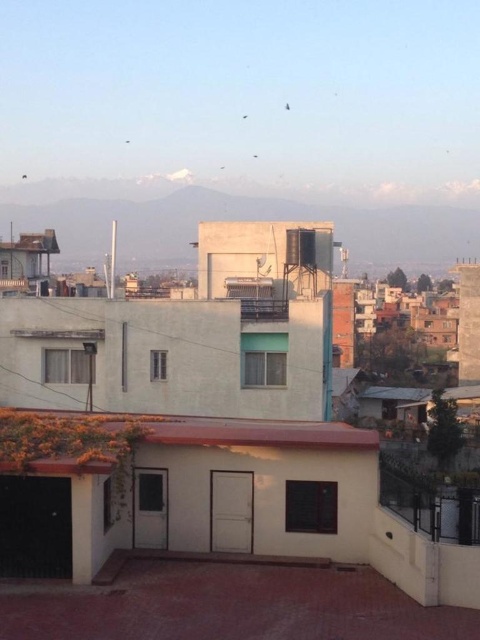
You are standing in the cityscape scene and want to take a photo. There are two points marked in the image, point (131, 253) and point (337, 422). Which point is closer to your camera when taking the photo?

Point (131, 253) is further to the camera than point (337, 422), so the point closer to the camera is point (131, 253).